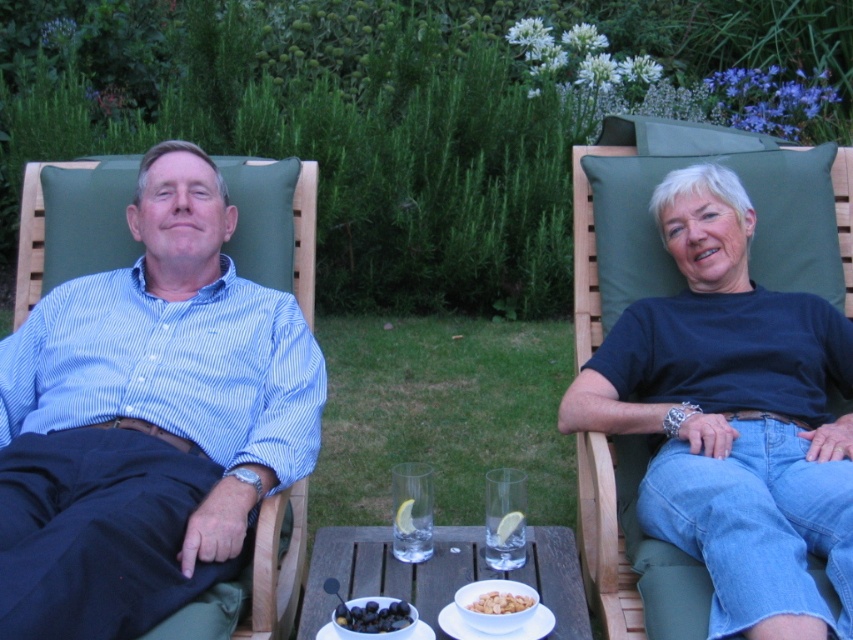
Question: Where is dark blue t-shirt at right located in relation to blue striped shirt at left in the image?

Choices:
 (A) right
 (B) left

Answer: (A)

Question: Considering the relative positions of black matte grapes at lower center and white matte bowl at lower center in the image provided, where is black matte grapes at lower center located with respect to white matte bowl at lower center?

Choices:
 (A) right
 (B) left

Answer: (B)

Question: Is dark blue t-shirt at right closer to camera compared to smooth beige nuts at lower center?

Choices:
 (A) yes
 (B) no

Answer: (A)

Question: Considering the real-world distances, which object is farthest from the dark blue t-shirt at right?

Choices:
 (A) white matte bowl at lower center
 (B) black matte grapes at lower center

Answer: (B)

Question: Which of these objects is positioned closest to the smooth beige nuts at lower center?

Choices:
 (A) dark blue t-shirt at right
 (B) white matte bowl at lower center

Answer: (B)

Question: Which object appears closest to the camera in this image?

Choices:
 (A) dark blue t-shirt at right
 (B) white matte bowl at lower center

Answer: (A)